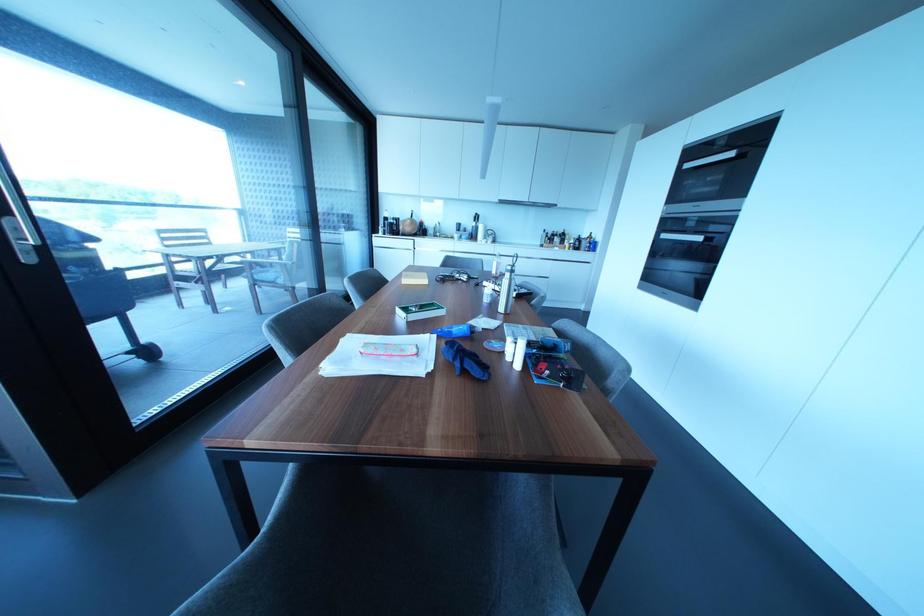
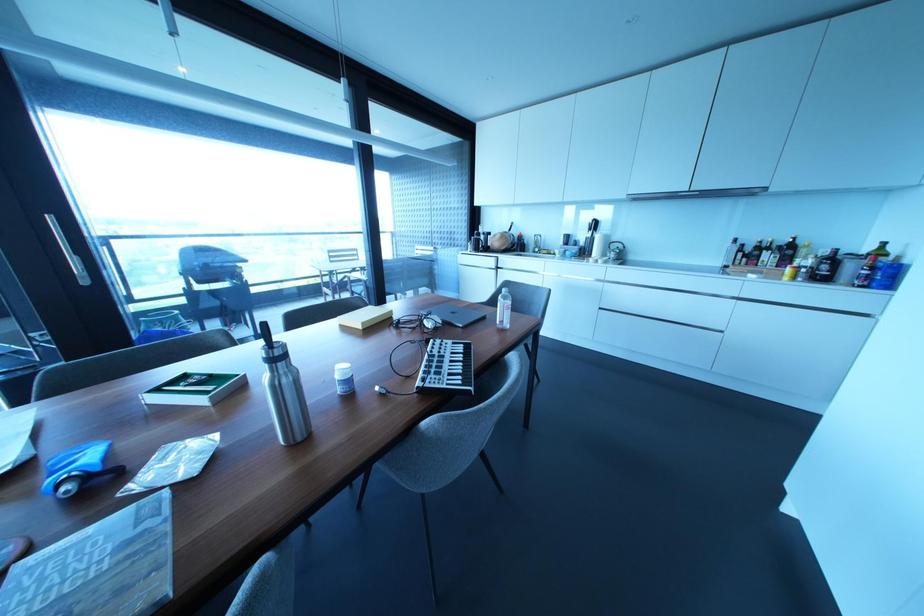
Find the pixel in the second image that matches [578,238] in the first image.

(833, 257)